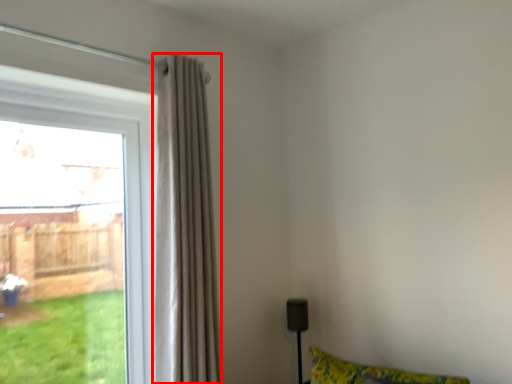
Question: Where is curtain (annotated by the red box) located in relation to window in the image?

Choices:
 (A) right
 (B) left

Answer: (A)